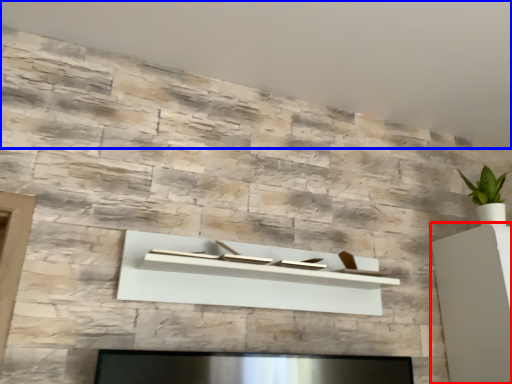
Question: Which point is closer to the camera, furniture (highlighted by a red box) or backdrop (highlighted by a blue box)?

Choices:
 (A) furniture
 (B) backdrop

Answer: (B)